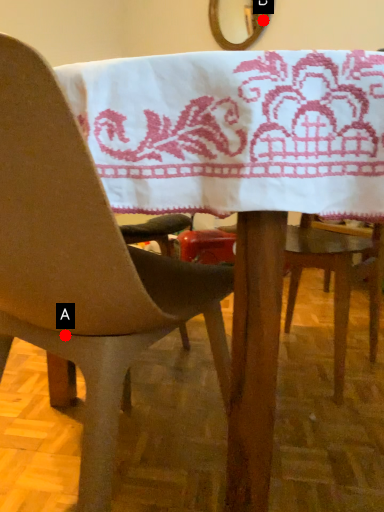
Question: Two points are circled on the image, labeled by A and B beside each circle. Among these points, which one is farthest from the camera?

Choices:
 (A) A is further
 (B) B is further

Answer: (B)